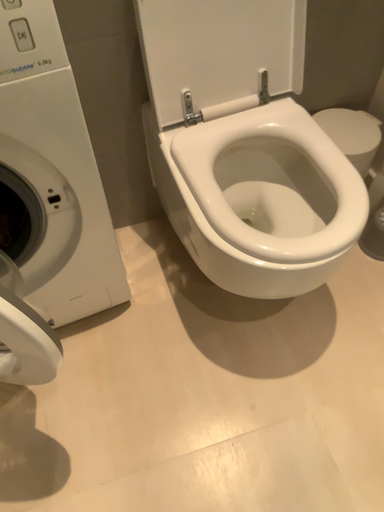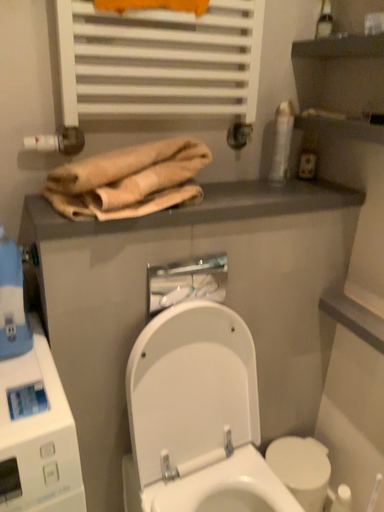
Question: Which way did the camera rotate in the video?

Choices:
 (A) rotated upward
 (B) rotated downward

Answer: (A)